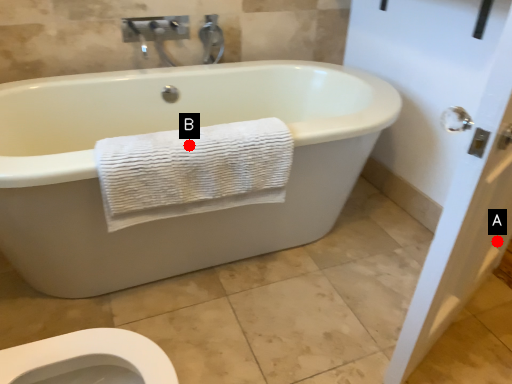
Question: Two points are circled on the image, labeled by A and B beside each circle. Among these points, which one is farthest from the camera?

Choices:
 (A) A is further
 (B) B is further

Answer: (A)